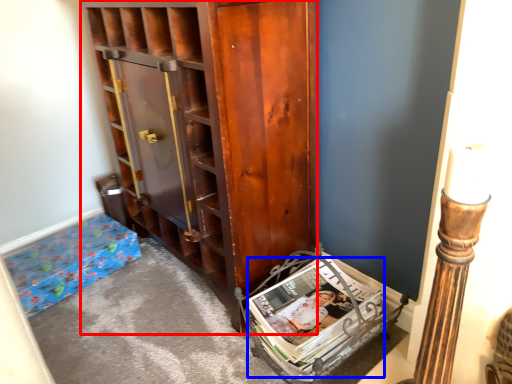
Question: Which object is further to the camera taking this photo, cabinetry (highlighted by a red box) or magazine (highlighted by a blue box)?

Choices:
 (A) cabinetry
 (B) magazine

Answer: (B)